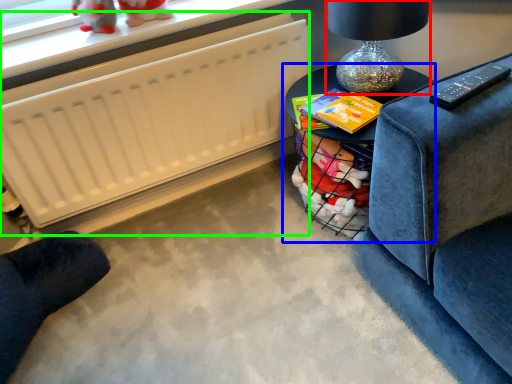
Question: Which is nearer to the table lamp (highlighted by a red box)? table (highlighted by a blue box) or radiator (highlighted by a green box).

Choices:
 (A) table
 (B) radiator

Answer: (A)